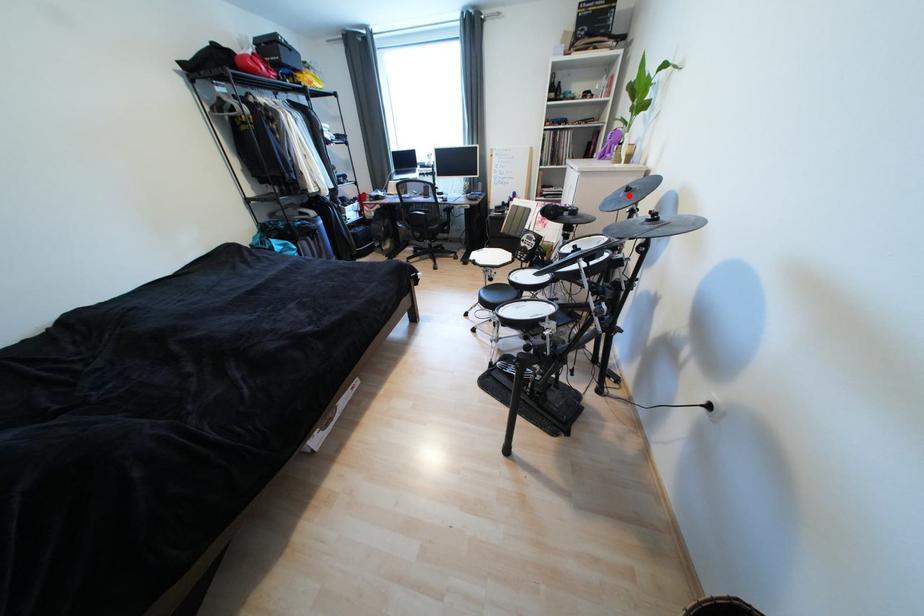
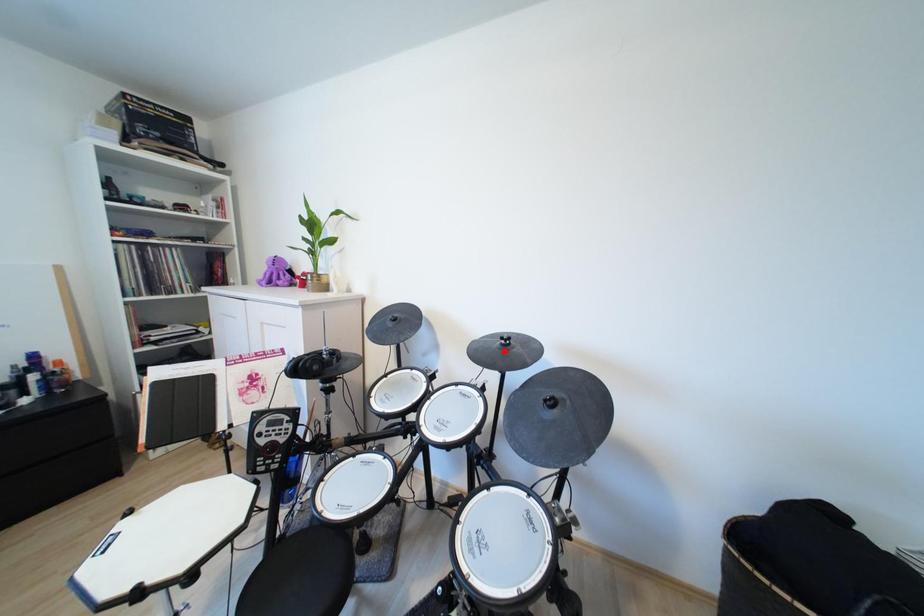
I am providing you with two images of the same scene from different viewpoints. A red point is marked on the first image and another point is marked on the second image. Does the point marked in image1 correspond to the same location as the one in image2?

No